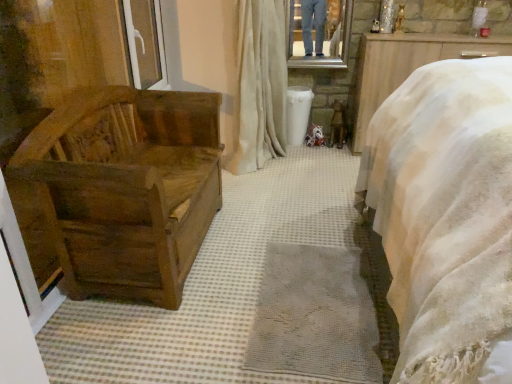
What do you see at coordinates (260, 85) in the screenshot?
I see `satin beige curtain at center` at bounding box center [260, 85].

What do you see at coordinates (127, 188) in the screenshot? I see `wooden chest at left` at bounding box center [127, 188].

Where is `wooden chest at left`? wooden chest at left is located at coordinates (127, 188).

Locate an element on the screen. The width and height of the screenshot is (512, 384). satin beige curtain at center is located at coordinates tap(260, 85).

Looking at this image, considering the relative sizes of wooden chest at left and satin beige curtain at center in the image provided, is wooden chest at left taller than satin beige curtain at center?

Incorrect, the height of wooden chest at left is not larger of that of satin beige curtain at center.

Is wooden chest at left oriented towards satin beige curtain at center?

No, wooden chest at left is not aimed at satin beige curtain at center.

You are a GUI agent. You are given a task and a screenshot of the screen. Output one action in this format:
    pyautogui.click(x=<x>, y=<y>)
    Task: Click on the furniture below the satin beige curtain at center (from a real-world perspective)
    This screenshot has height=384, width=512.
    Given the screenshot: What is the action you would take?
    pyautogui.click(x=127, y=188)

Consider the image. From a real-world perspective, does wooden chest at left stand above satin beige curtain at center?

No.

From a real-world perspective, is white plastic window at upper left positioned over satin beige curtain at center based on gravity?

Yes, from a real-world perspective, white plastic window at upper left is over satin beige curtain at center

Who is smaller, white plastic window at upper left or satin beige curtain at center?

With smaller size is white plastic window at upper left.

Is the depth of white plastic window at upper left less than that of satin beige curtain at center?

Yes, white plastic window at upper left is closer to the camera.

Which object is positioned more to the right, white plastic window at upper left or satin beige curtain at center?

satin beige curtain at center is more to the right.

In the scene shown: Considering the positions of objects satin beige curtain at center and metallic reflective mirror at upper center in the image provided, who is behind, satin beige curtain at center or metallic reflective mirror at upper center?

metallic reflective mirror at upper center is more distant.

From the image's perspective, which one is positioned higher, satin beige curtain at center or metallic reflective mirror at upper center?

From the image's view, metallic reflective mirror at upper center is above.

Locate an element on the screen. This screenshot has width=512, height=384. curtain that appears below the metallic reflective mirror at upper center (from the image's perspective) is located at coordinates (260, 85).

From the picture: Could you tell me if satin beige curtain at center is turned towards metallic reflective mirror at upper center?

Yes, satin beige curtain at center is aimed at metallic reflective mirror at upper center.

Consider the image. How many degrees apart are the facing directions of wooden chest at left and white plastic window at upper left?

They differ by 1.57 degrees in their facing directions.

Is wooden chest at left turned away from white plastic window at upper left?

No, wooden chest at left's orientation is not away from white plastic window at upper left.

Which object is further away from the camera taking this photo, wooden chest at left or white plastic window at upper left?

white plastic window at upper left is further away from the camera.

From the image's perspective, between wooden chest at left and white plastic window at upper left, which one is located above?

white plastic window at upper left.

Is metallic reflective mirror at upper center oriented towards satin beige curtain at center?

Yes, metallic reflective mirror at upper center is aimed at satin beige curtain at center.

Between metallic reflective mirror at upper center and satin beige curtain at center, which one appears on the left side from the viewer's perspective?

From the viewer's perspective, satin beige curtain at center appears more on the left side.

Is metallic reflective mirror at upper center with satin beige curtain at center?

There is a gap between metallic reflective mirror at upper center and satin beige curtain at center.

Based on the photo, is metallic reflective mirror at upper center situated inside satin beige curtain at center or outside?

The correct answer is: outside.

Which object is wider, metallic reflective mirror at upper center or wooden chest at left?

Wider between the two is wooden chest at left.

Locate an element on the screen. furniture located below the metallic reflective mirror at upper center (from the image's perspective) is located at coordinates (127, 188).

Can you tell me how much metallic reflective mirror at upper center and wooden chest at left differ in facing direction?

The angle between the facing direction of metallic reflective mirror at upper center and the facing direction of wooden chest at left is 90.7 degrees.

From a real-world perspective, is metallic reflective mirror at upper center on top of wooden chest at left?

Indeed, from a real-world perspective, metallic reflective mirror at upper center stands above wooden chest at left.

Which object is wider, metallic reflective mirror at upper center or white plastic window at upper left?

white plastic window at upper left.

Consider the image. Could you tell me if metallic reflective mirror at upper center is facing white plastic window at upper left?

No, metallic reflective mirror at upper center is not facing towards white plastic window at upper left.

Where is `curtain that appears behind the wooden chest at left`? This screenshot has width=512, height=384. curtain that appears behind the wooden chest at left is located at coordinates (260, 85).

The width and height of the screenshot is (512, 384). I want to click on window frame that is on the left side of satin beige curtain at center, so click(145, 43).

When comparing their distances from satin beige curtain at center, does wooden chest at left or metallic reflective mirror at upper center seem closer?

The object closer to satin beige curtain at center is metallic reflective mirror at upper center.

When comparing their distances from metallic reflective mirror at upper center, does white plastic window at upper left or satin beige curtain at center seem further?

Based on the image, white plastic window at upper left appears to be further to metallic reflective mirror at upper center.

Considering their positions, is metallic reflective mirror at upper center positioned closer to satin beige curtain at center than white plastic window at upper left?

The object closer to satin beige curtain at center is metallic reflective mirror at upper center.

Estimate the real-world distances between objects in this image. Which object is closer to wooden chest at left, metallic reflective mirror at upper center or satin beige curtain at center?

satin beige curtain at center is closer to wooden chest at left.

Based on their spatial positions, is white plastic window at upper left or metallic reflective mirror at upper center further from wooden chest at left?

The object further to wooden chest at left is metallic reflective mirror at upper center.

Estimate the real-world distances between objects in this image. Which object is closer to metallic reflective mirror at upper center, wooden chest at left or white plastic window at upper left?

white plastic window at upper left.

Based on their spatial positions, is satin beige curtain at center or wooden chest at left closer to metallic reflective mirror at upper center?

The object closer to metallic reflective mirror at upper center is satin beige curtain at center.

Looking at the image, which one is located closer to wooden chest at left, white plastic window at upper left or satin beige curtain at center?

Based on the image, satin beige curtain at center appears to be nearer to wooden chest at left.

You are a GUI agent. You are given a task and a screenshot of the screen. Output one action in this format:
    pyautogui.click(x=<x>, y=<y>)
    Task: Click on the curtain positioned between wooden chest at left and metallic reflective mirror at upper center from near to far
    This screenshot has height=384, width=512.
    Given the screenshot: What is the action you would take?
    pyautogui.click(x=260, y=85)

At what (x,y) coordinates should I click in order to perform the action: click on window frame between wooden chest at left and metallic reflective mirror at upper center from front to back. Please return your answer as a coordinate pair (x, y). The width and height of the screenshot is (512, 384). Looking at the image, I should click on (145, 43).

The width and height of the screenshot is (512, 384). In order to click on curtain situated between white plastic window at upper left and metallic reflective mirror at upper center from left to right in this screenshot , I will do click(260, 85).

The width and height of the screenshot is (512, 384). Find the location of `window frame positioned between wooden chest at left and satin beige curtain at center from near to far`. window frame positioned between wooden chest at left and satin beige curtain at center from near to far is located at coordinates (145, 43).